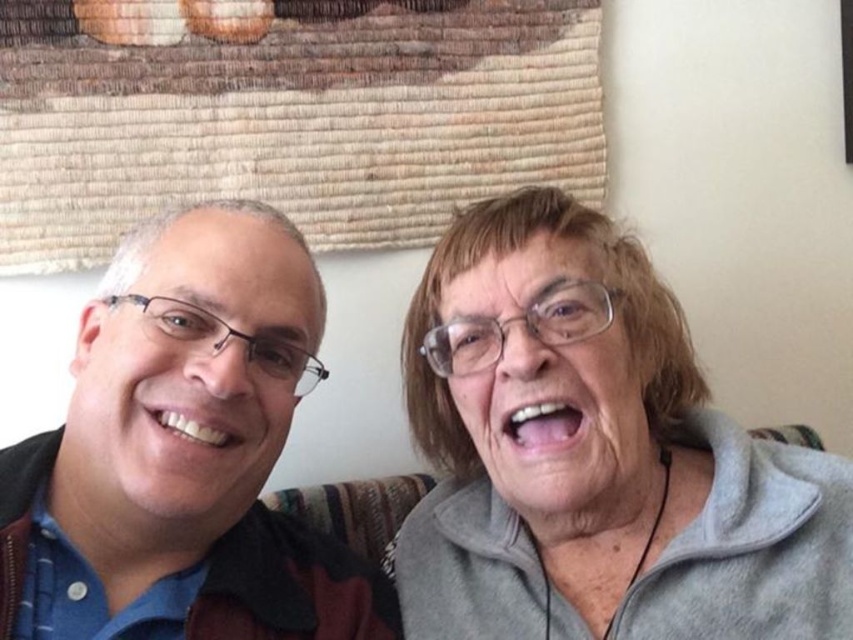
Who is positioned more to the right, gray fleece at center or matte black jacket at left?

gray fleece at center

The width and height of the screenshot is (853, 640). Identify the location of gray fleece at center. [x=596, y=456].